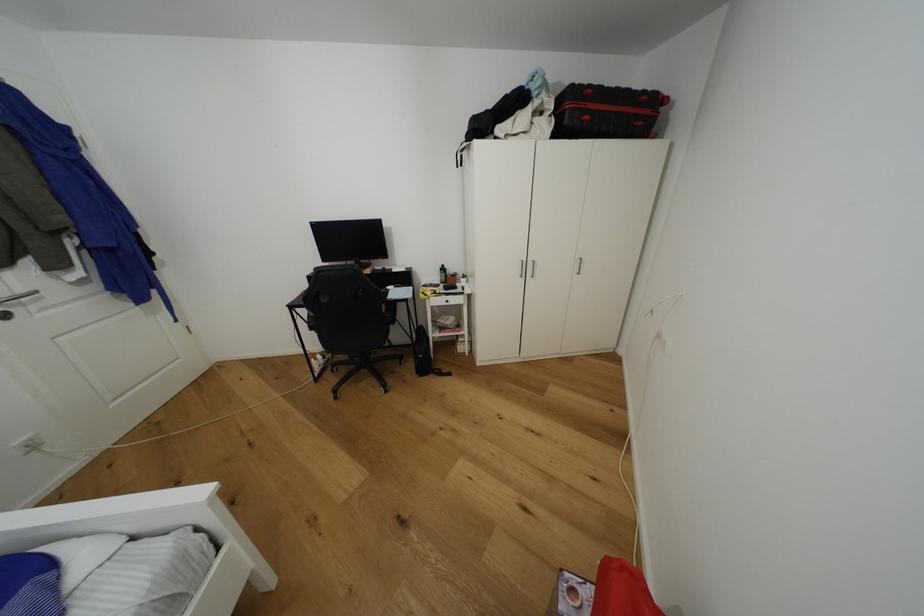
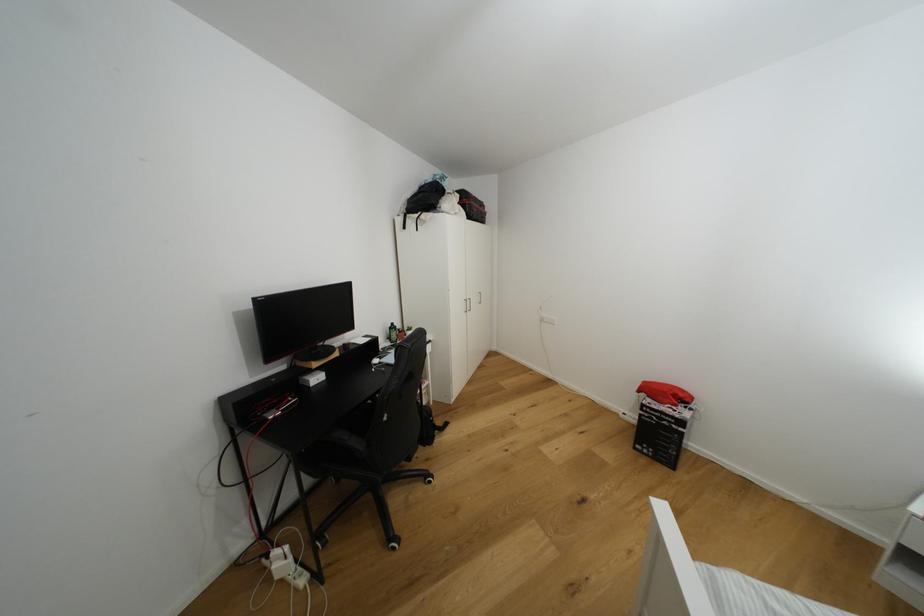
Question: I am providing you with two images of the same scene from different viewpoints. Which of the following objects are not visible in image2?

Choices:
 (A) black backpack
 (B) green bottle
 (C) white bag
 (D) none of these

Answer: (D)